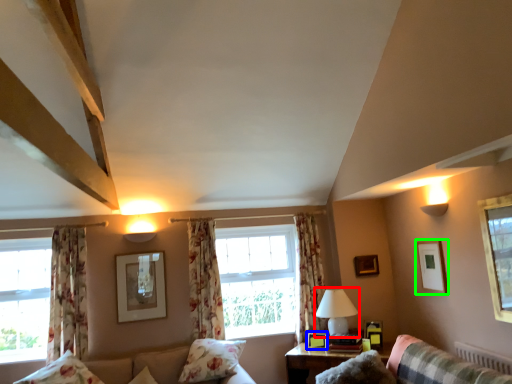
Question: Based on their relative distances, which object is farther from table lamp (highlighted by a red box)? Choose from picture frame (highlighted by a blue box) and picture frame (highlighted by a green box).

Choices:
 (A) picture frame
 (B) picture frame

Answer: (B)